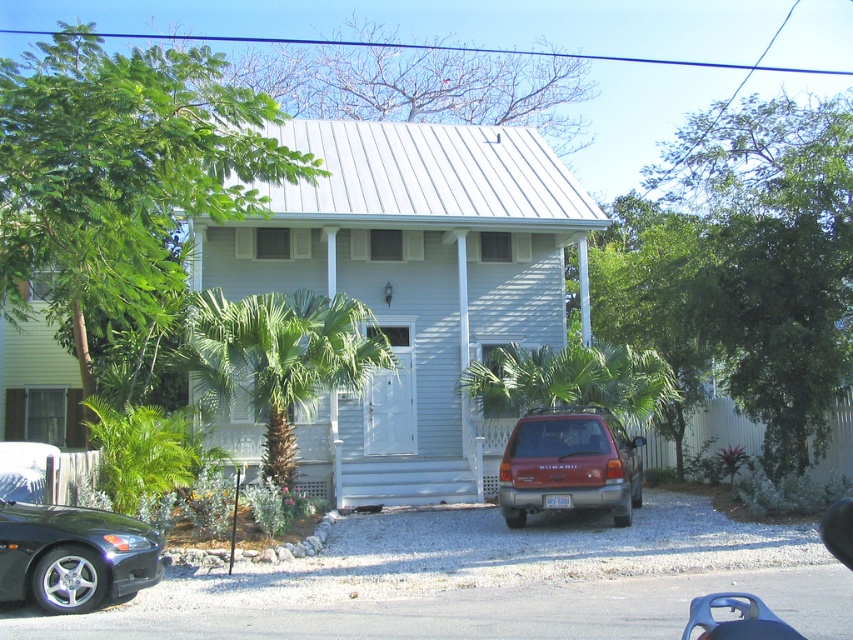
You are standing in front of the house and want to walk to the green leafy palm tree at center. Which direction should you move relative to the gray asphalt driveway at lower center?

You should move towards the green leafy palm tree at center, which is behind the gray asphalt driveway at lower center since the driveway is closer to you.

You are driving a matte red suv at lower right and want to park it on the gray asphalt driveway at lower center. Can you safely maneuver the suv into the driveway without hitting any obstacles?

The gray asphalt driveway at lower center is 6.94 meters away from the matte red suv at lower right. Since the distance between them is sufficient, you can safely maneuver the matte red suv at lower right into the gray asphalt driveway at lower center without hitting any obstacles.

You are a delivery person with a 12 feet long ladder that needs to be delivered to the house. The ladder must be carried upright. Is there enough space between the green leafy palm tree at center and the shiny black car at lower left to maneuver the ladder upright?

The distance between the green leafy palm tree at center and the shiny black car at lower left is 18.13 feet. Since the ladder is 12 feet long, there is sufficient space to maneuver it upright between them.